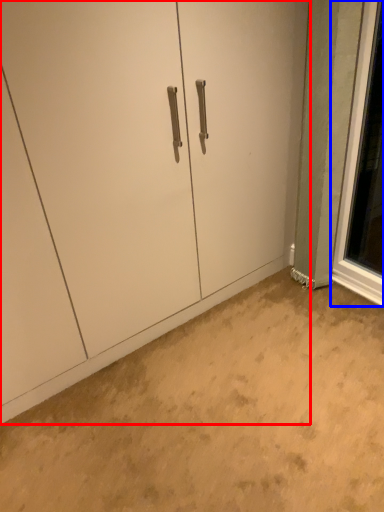
Question: Which point is closer to the camera, door (highlighted by a red box) or window (highlighted by a blue box)?

Choices:
 (A) door
 (B) window

Answer: (A)